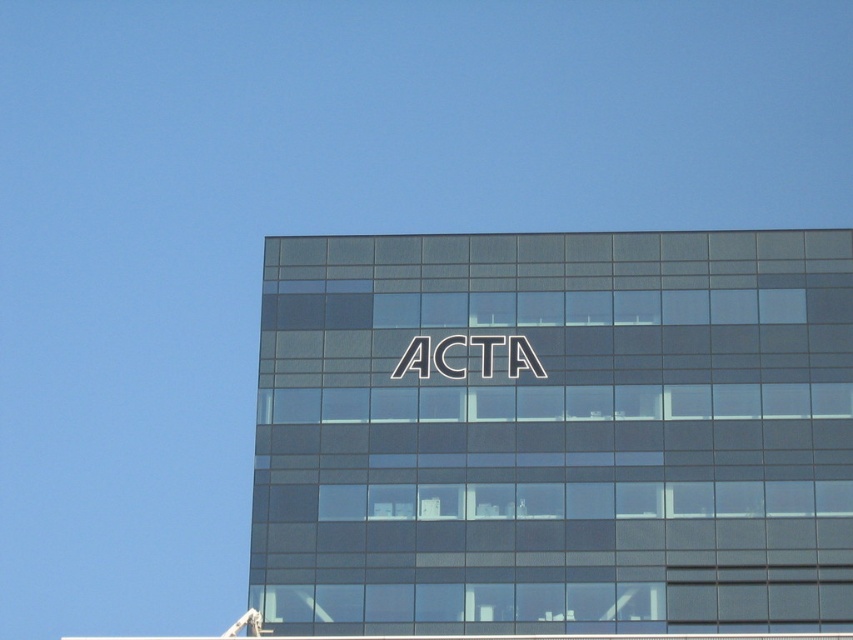
Who is shorter, satin glass building at center or white metallic logo at center?

white metallic logo at center is shorter.

Is satin glass building at center below white metallic logo at center?

Yes.

Which is in front, point (544, 604) or point (476, 337)?

Point (544, 604) is in front.

Locate an element on the screen. Image resolution: width=853 pixels, height=640 pixels. satin glass building at center is located at coordinates (556, 433).